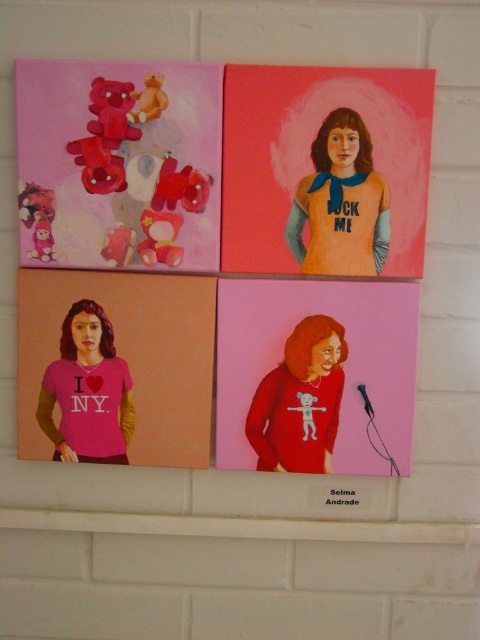
Which is above, matte red sweater at lower right or black plastic microphone at lower right?

matte red sweater at lower right

Can you confirm if matte red sweater at lower right is taller than black plastic microphone at lower right?

Yes, matte red sweater at lower right is taller than black plastic microphone at lower right.

Is point (316, 401) more distant than point (371, 410)?

Yes, it is behind point (371, 410).

The width and height of the screenshot is (480, 640). Identify the location of matte red sweater at lower right. (300, 401).

Is point (228, 404) closer to viewer compared to point (348, 148)?

No, (228, 404) is behind (348, 148).

Based on the photo, who is positioned more to the right, matte red sweater at center or matte blue fabric shirt at upper center?

matte blue fabric shirt at upper center

The height and width of the screenshot is (640, 480). In order to click on matte red sweater at center in this screenshot , I will do `click(314, 374)`.

Who is lower down, matte plastic teddy bears at upper left or matte blue fabric shirt at upper center?

Positioned lower is matte blue fabric shirt at upper center.

Measure the distance between matte plastic teddy bears at upper left and camera.

A distance of 36.22 inches exists between matte plastic teddy bears at upper left and camera.

Image resolution: width=480 pixels, height=640 pixels. I want to click on matte plastic teddy bears at upper left, so click(119, 163).